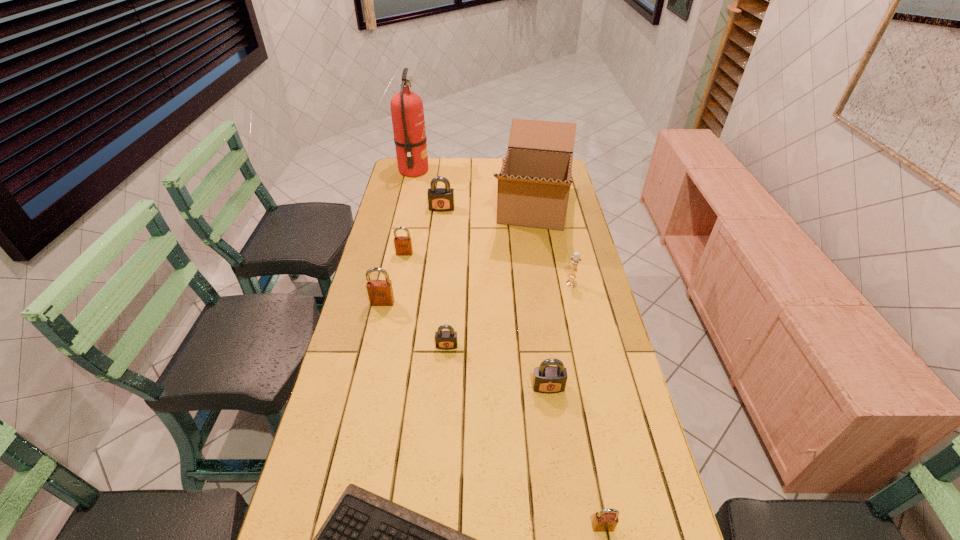
This screenshot has width=960, height=540. What are the coordinates of `vacant space that is in between the biggest gray padlock and the ninth shortest object` in the screenshot? It's located at point(488,209).

This screenshot has height=540, width=960. I want to click on free space between the fifth nearest object and the second nearest padlock, so click(466, 345).

You are a GUI agent. You are given a task and a screenshot of the screen. Output one action in this format:
    pyautogui.click(x=<x>, y=<y>)
    Task: Click on the free space that is in between the fifth nearest padlock and the farthest gray padlock
    
    Given the screenshot: What is the action you would take?
    pyautogui.click(x=423, y=231)

This screenshot has height=540, width=960. What are the coordinates of `empty space that is in between the rightmost padlock and the farthest gray padlock` in the screenshot? It's located at (522, 368).

Select which object appears as the ninth closest to the shortest object. Please provide its 2D coordinates. Your answer should be formatted as a tuple, i.e. [(x, y)], where the tuple contains the x and y coordinates of a point satisfying the conditions above.

[(407, 112)]

Identify which object is the fourth nearest to the nearest brown padlock. Please provide its 2D coordinates. Your answer should be formatted as a tuple, i.e. [(x, y)], where the tuple contains the x and y coordinates of a point satisfying the conditions above.

[(576, 259)]

Find the location of `padlock that can be found as the fourth closest to the farthest brown padlock`. padlock that can be found as the fourth closest to the farthest brown padlock is located at coordinates (547, 379).

Locate which padlock is the second closest to the shortest object. Please provide its 2D coordinates. Your answer should be formatted as a tuple, i.e. [(x, y)], where the tuple contains the x and y coordinates of a point satisfying the conditions above.

[(547, 379)]

Locate an element on the screen. This screenshot has height=540, width=960. the second closest gray padlock to the second farthest brown padlock is located at coordinates (x=547, y=379).

Image resolution: width=960 pixels, height=540 pixels. Find the location of `gray padlock that is the second nearest to the sixth nearest object`. gray padlock that is the second nearest to the sixth nearest object is located at coordinates (445, 340).